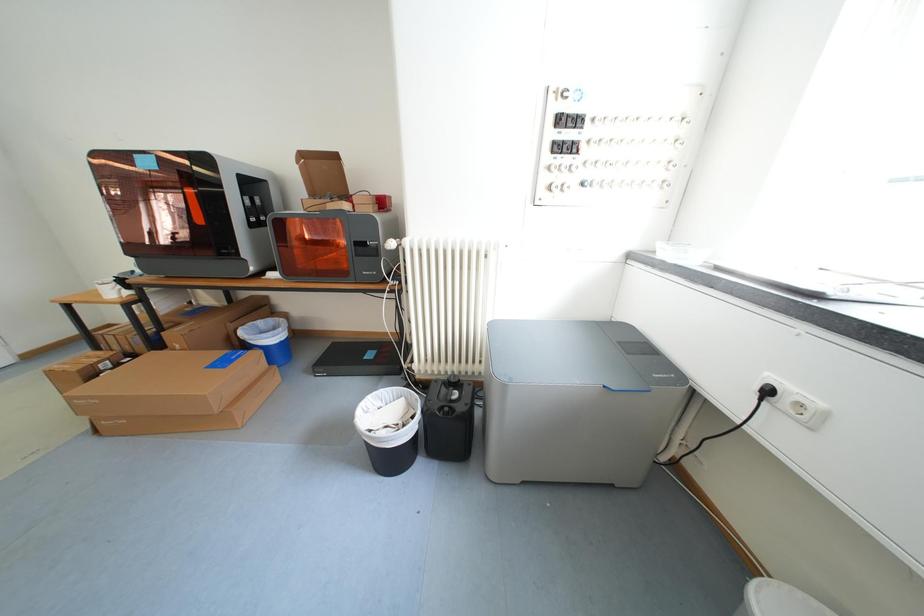
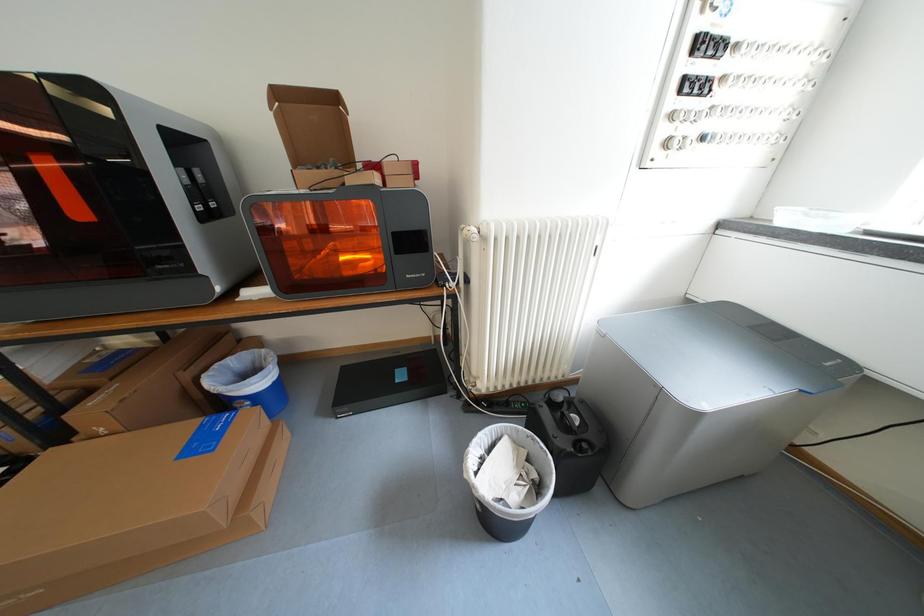
What movement of the cameraman would produce the second image?

The cameraman walked toward left, forward.